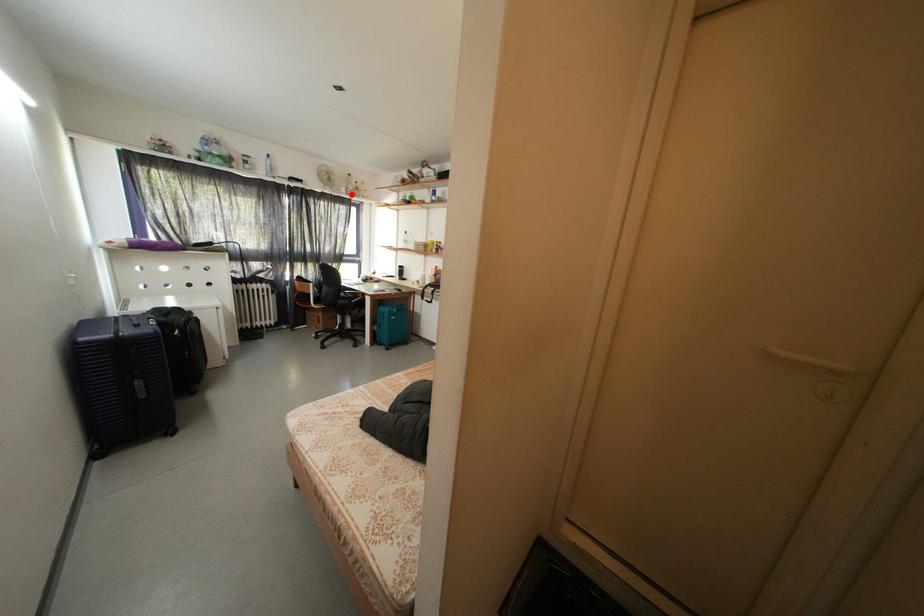
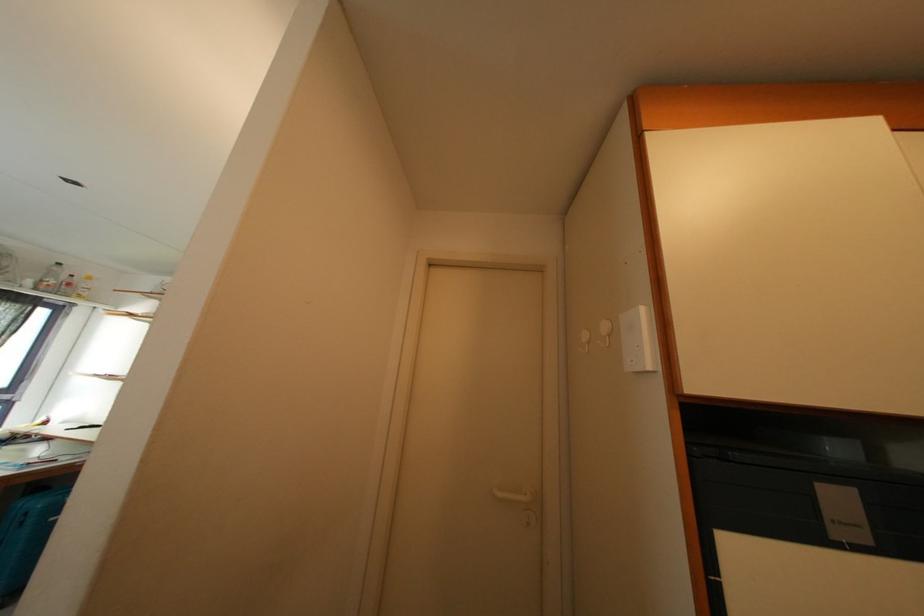
In the second image, find the point that corresponds to the highlighted location in the first image.

(38, 286)